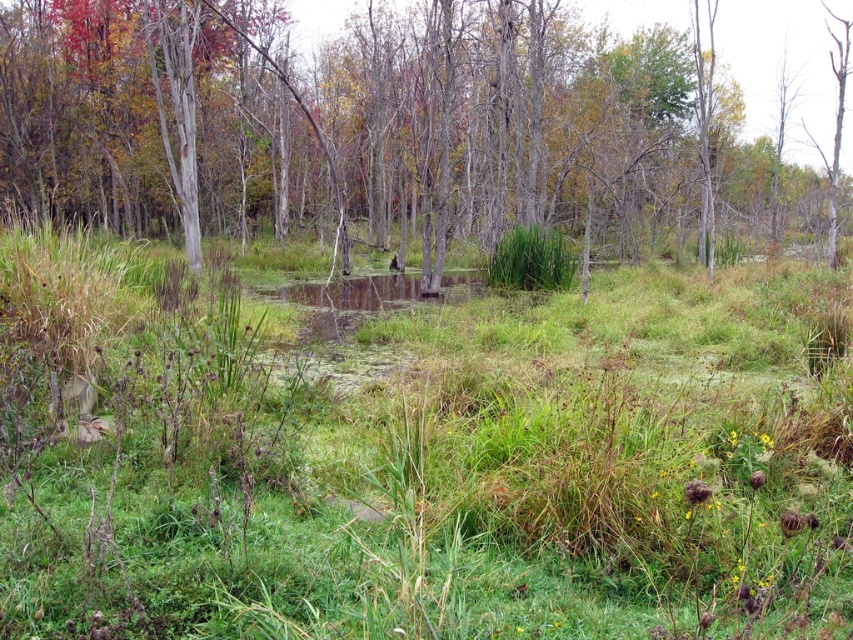
Where is `green grassy at center`? The image size is (853, 640). green grassy at center is located at coordinates (421, 464).

This screenshot has width=853, height=640. I want to click on green grassy at center, so (421, 464).